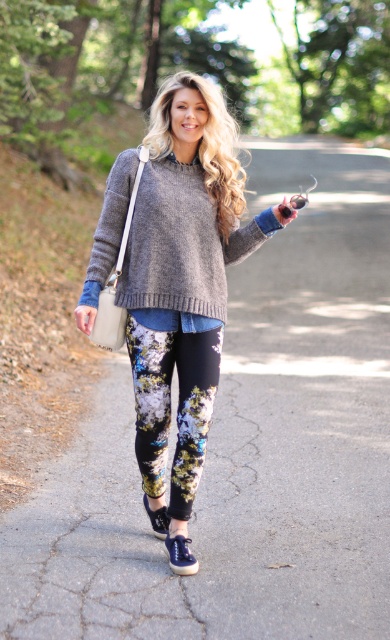
The person in the image is wearing a knit gray sweater at center and floral printed leggings at center. Which clothing item reaches lower on their body?

The floral printed leggings at center reach lower on the body since the knit gray sweater at center is shorter than the floral printed leggings at center.